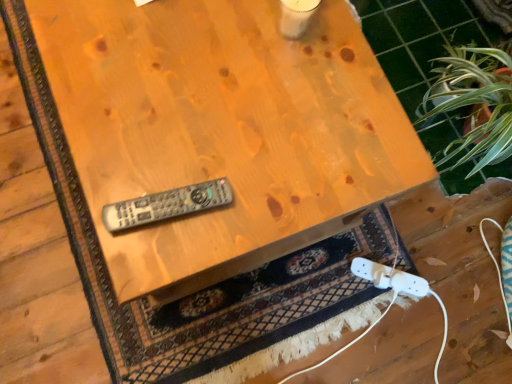
Question: From a real-world perspective, is wooden table at upper right positioned over gray plastic remote at center based on gravity?

Choices:
 (A) no
 (B) yes

Answer: (A)

Question: Is wooden table at upper right smaller than gray plastic remote at center?

Choices:
 (A) no
 (B) yes

Answer: (A)

Question: Does wooden table at upper right have a lesser width compared to gray plastic remote at center?

Choices:
 (A) no
 (B) yes

Answer: (A)

Question: Is the position of wooden table at upper right less distant than that of gray plastic remote at center?

Choices:
 (A) no
 (B) yes

Answer: (A)

Question: Are wooden table at upper right and gray plastic remote at center far apart?

Choices:
 (A) yes
 (B) no

Answer: (A)

Question: Is green leafy plant at upper right inside or outside of gray plastic remote at center?

Choices:
 (A) outside
 (B) inside

Answer: (A)

Question: Considering their positions, is green leafy plant at upper right located in front of or behind gray plastic remote at center?

Choices:
 (A) front
 (B) behind

Answer: (B)

Question: In terms of width, does green leafy plant at upper right look wider or thinner when compared to gray plastic remote at center?

Choices:
 (A) wide
 (B) thin

Answer: (B)

Question: In the image, is green leafy plant at upper right on the left side or the right side of gray plastic remote at center?

Choices:
 (A) left
 (B) right

Answer: (B)

Question: From a real-world perspective, is gray plastic remote at center physically located above or below white plastic game controller at lower right?

Choices:
 (A) below
 (B) above

Answer: (B)

Question: Considering the positions of gray plastic remote at center and white plastic game controller at lower right in the image, is gray plastic remote at center taller or shorter than white plastic game controller at lower right?

Choices:
 (A) short
 (B) tall

Answer: (B)

Question: In terms of size, does gray plastic remote at center appear bigger or smaller than white plastic game controller at lower right?

Choices:
 (A) small
 (B) big

Answer: (A)

Question: Looking at their shapes, would you say gray plastic remote at center is wider or thinner than white plastic game controller at lower right?

Choices:
 (A) thin
 (B) wide

Answer: (A)

Question: From the image's perspective, is wooden remote control at center positioned above or below gray plastic remote at center?

Choices:
 (A) below
 (B) above

Answer: (B)

Question: Considering the positions of wooden remote control at center and gray plastic remote at center in the image, is wooden remote control at center taller or shorter than gray plastic remote at center?

Choices:
 (A) tall
 (B) short

Answer: (A)